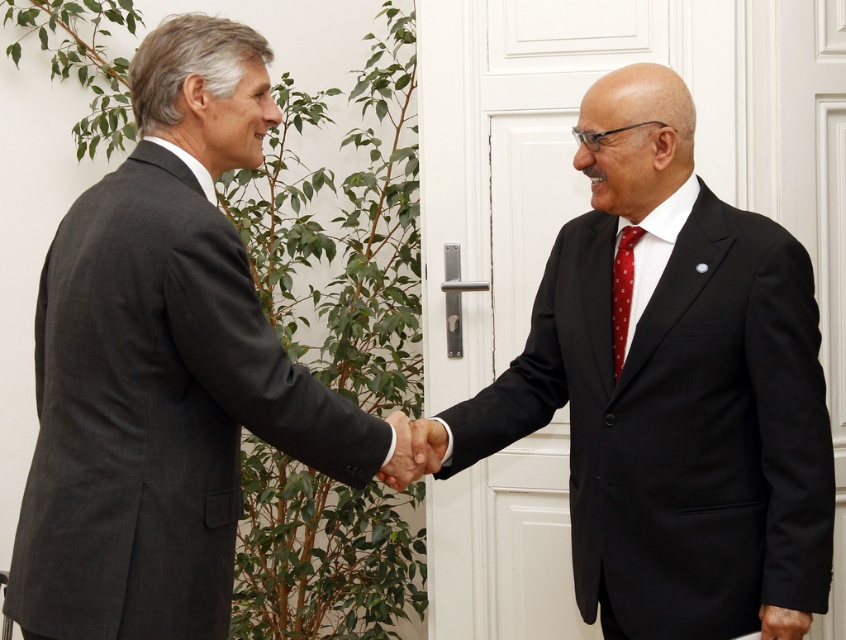
In the image, there is a point labeled at coordinates (411, 451). Based on the scene description, what object or part of the scene does this point most likely represent?

The point at coordinates (411, 451) corresponds to the black smooth hand at center.

You are a photographer setting up a shot of the two men shaking hands. You need to ensure that the black smooth hand at center and the red dotted tie at right are both in focus. Given that your camera has a depth of field that can cover 18 inches, will both objects be in focus?

The black smooth hand at center is 18.83 inches from the red dotted tie at right. Since the distance between them exceeds the camera depth of field of 18 inches, the two objects may not both be in focus simultaneously.